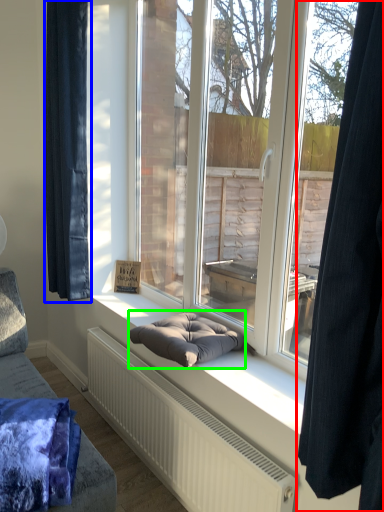
Question: Which object is the closest to the curtain (highlighted by a red box)? Choose among these: curtain (highlighted by a blue box) or footrest (highlighted by a green box).

Choices:
 (A) curtain
 (B) footrest

Answer: (B)